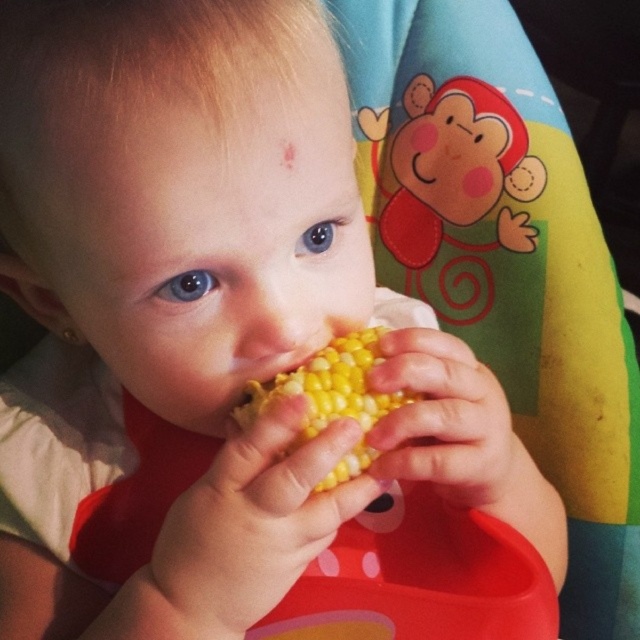
Measure the distance between yellow matte corn at center and camera.

The distance of yellow matte corn at center from camera is 36.52 centimeters.

Is yellow matte corn at center thinner than smooth skin ear at left?

In fact, yellow matte corn at center might be wider than smooth skin ear at left.

Between point (308, 371) and point (35, 284), which one is positioned in front?

Positioned in front is point (308, 371).

You are a GUI agent. You are given a task and a screenshot of the screen. Output one action in this format:
    pyautogui.click(x=<x>, y=<y>)
    Task: Click on the yellow matte corn at center
    The height and width of the screenshot is (640, 640).
    Given the screenshot: What is the action you would take?
    pyautogui.click(x=328, y=387)